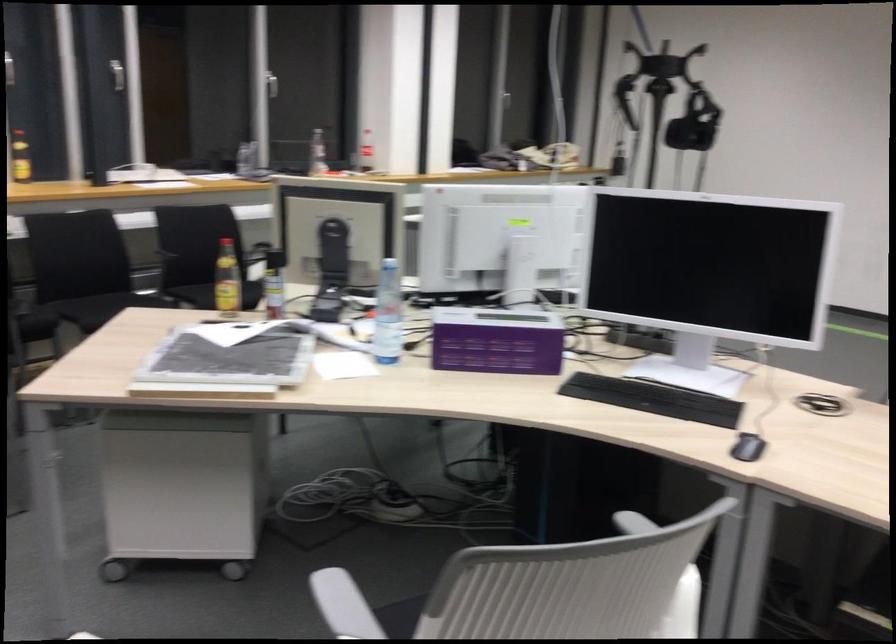
The image size is (896, 644). Find the location of `clear water bottle`. clear water bottle is located at coordinates (388, 315).